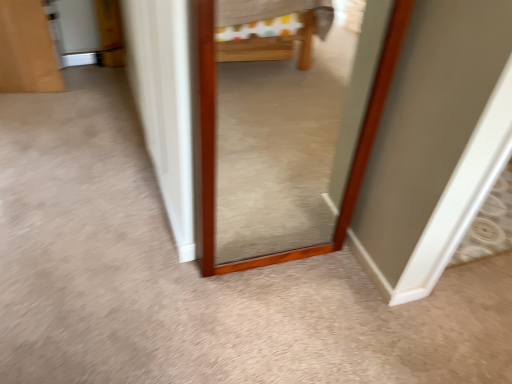
The image size is (512, 384). Find the location of `free space in front of wooden frame mirror at center`. free space in front of wooden frame mirror at center is located at coordinates (253, 297).